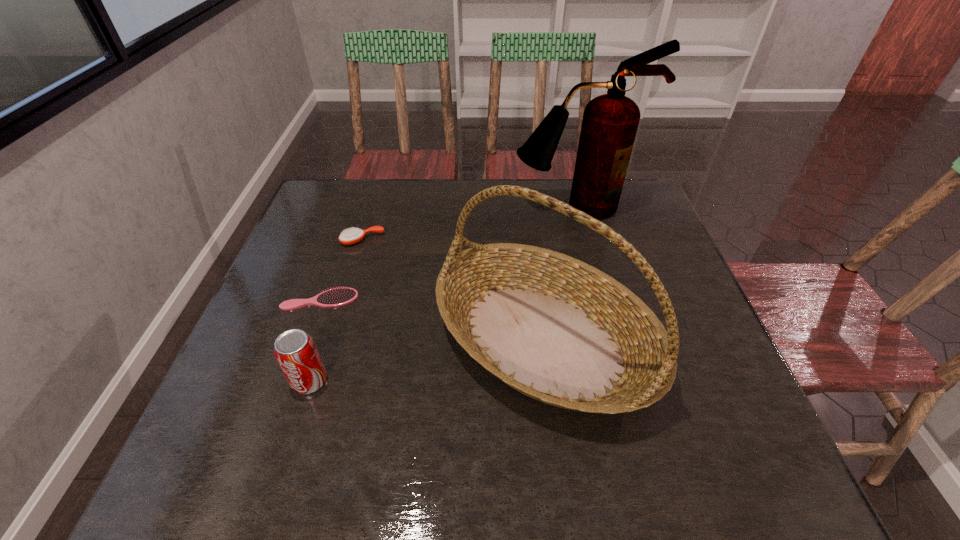
Find the location of `vacant region located 0.090m on the front of the third shortest object`. vacant region located 0.090m on the front of the third shortest object is located at coordinates (290, 441).

The height and width of the screenshot is (540, 960). In order to click on vacant region located 0.340m on the front of the fourth nearest object in this screenshot , I will do `click(329, 352)`.

Image resolution: width=960 pixels, height=540 pixels. In order to click on free location located on the back of the shorter hairbrush in this screenshot , I will do `click(332, 267)`.

Identify the location of object that is positioned at the far edge. (610, 121).

Where is `object situated at the near edge`? object situated at the near edge is located at coordinates (558, 330).

I want to click on soda can that is at the left edge, so click(x=295, y=351).

Image resolution: width=960 pixels, height=540 pixels. I want to click on fire extinguisher situated at the right edge, so click(610, 121).

The height and width of the screenshot is (540, 960). I want to click on basket that is positioned at the right edge, so click(558, 330).

Image resolution: width=960 pixels, height=540 pixels. Identify the location of object that is at the far right corner. (610, 121).

Find the location of a particular element. This screenshot has width=960, height=540. object at the near right corner is located at coordinates (558, 330).